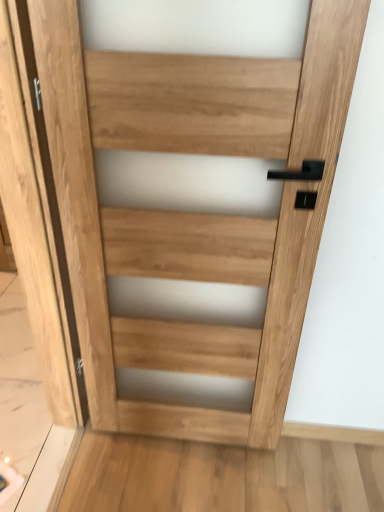
Identify the location of natural wood screen door at center. (39, 255).

What do you see at coordinates (39, 255) in the screenshot? I see `natural wood screen door at center` at bounding box center [39, 255].

Identify the location of natural wood screen door at center. (39, 255).